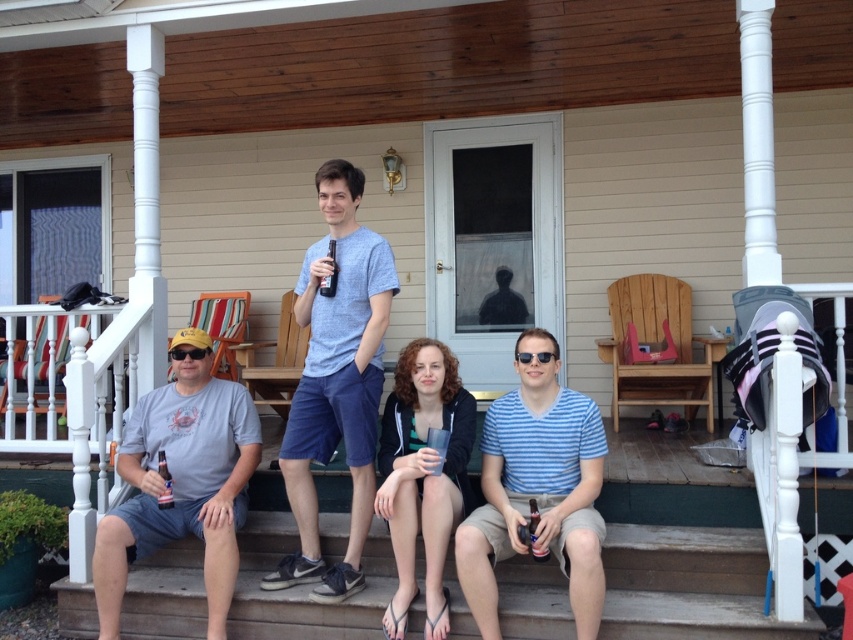
Question: Is metallic silver can at lower center below translucent plastic bottle at lower left?

Choices:
 (A) no
 (B) yes

Answer: (B)

Question: Is brown wooden stairs at lower center smaller than light blue t-shirt at center?

Choices:
 (A) yes
 (B) no

Answer: (B)

Question: Among these objects, which one is farthest from the camera?

Choices:
 (A) metallic silver can at lower center
 (B) light blue t-shirt at center
 (C) translucent plastic bottle at lower left
 (D) gray cotton t-shirt at left

Answer: (C)

Question: Which of the following is the farthest from the observer?

Choices:
 (A) (238, 525)
 (B) (537, 522)
 (C) (585, 444)
 (D) (332, 244)

Answer: (A)

Question: Does gray cotton t-shirt at left appear over metallic silver can at lower center?

Choices:
 (A) no
 (B) yes

Answer: (B)

Question: Among these objects, which one is nearest to the camera?

Choices:
 (A) light blue t-shirt at center
 (B) gray cotton t-shirt at left
 (C) brown glass bottle at center

Answer: (B)